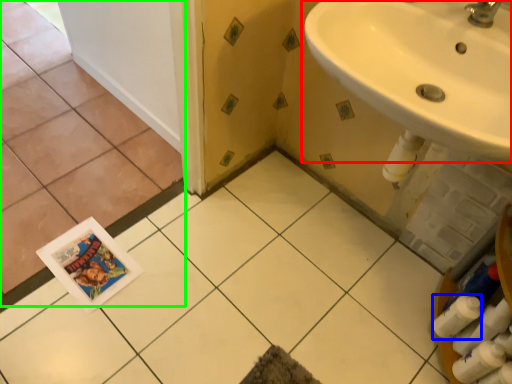
Question: Estimate the real-world distances between objects in this image. Which object is farther from sink (highlighted by a red box), toilet paper (highlighted by a blue box) or ceramic tile (highlighted by a green box)?

Choices:
 (A) toilet paper
 (B) ceramic tile

Answer: (B)